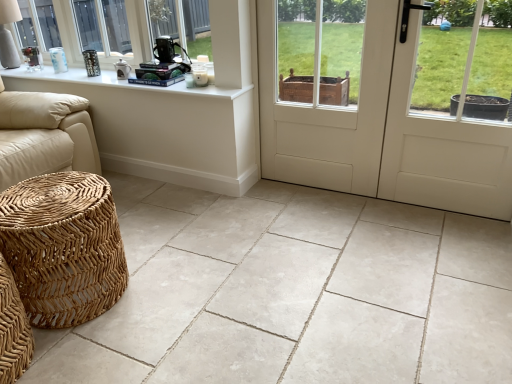
Find the location of a particular element. free space between woven natural basket at lower left and white wood screen door at center is located at coordinates (238, 231).